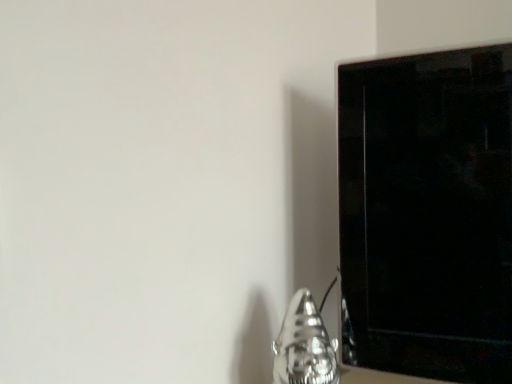
What do you see at coordinates (304, 345) in the screenshot?
I see `shiny metallic gnome at lower right` at bounding box center [304, 345].

Find the location of `shiny metallic gnome at lower right`. shiny metallic gnome at lower right is located at coordinates (304, 345).

Find the location of a particular element. Image resolution: width=512 pixels, height=384 pixels. black glossy tv at right is located at coordinates (426, 214).

Describe the element at coordinates (426, 214) in the screenshot. Image resolution: width=512 pixels, height=384 pixels. I see `black glossy tv at right` at that location.

Identify the location of shiny metallic gnome at lower right. The height and width of the screenshot is (384, 512). (304, 345).

Does black glossy tv at right appear on the right side of shiny metallic gnome at lower right?

Correct, you'll find black glossy tv at right to the right of shiny metallic gnome at lower right.

Which object is more forward, black glossy tv at right or shiny metallic gnome at lower right?

shiny metallic gnome at lower right is in front.

Is point (429, 288) positioned after point (301, 331)?

Yes, point (429, 288) is behind point (301, 331).

From the image's perspective, relative to shiny metallic gnome at lower right, is black glossy tv at right above or below?

black glossy tv at right is situated higher than shiny metallic gnome at lower right in the image.

From a real-world perspective, is black glossy tv at right physically located above or below shiny metallic gnome at lower right?

black glossy tv at right is above shiny metallic gnome at lower right.

Considering the relative sizes of black glossy tv at right and shiny metallic gnome at lower right in the image provided, is black glossy tv at right wider than shiny metallic gnome at lower right?

No, black glossy tv at right is not wider than shiny metallic gnome at lower right.

Considering the sizes of objects black glossy tv at right and shiny metallic gnome at lower right in the image provided, who is shorter, black glossy tv at right or shiny metallic gnome at lower right?

shiny metallic gnome at lower right.

Considering the relative sizes of black glossy tv at right and shiny metallic gnome at lower right in the image provided, is black glossy tv at right smaller than shiny metallic gnome at lower right?

No, black glossy tv at right is not smaller than shiny metallic gnome at lower right.

Is black glossy tv at right situated inside shiny metallic gnome at lower right or outside?

black glossy tv at right is located beyond the bounds of shiny metallic gnome at lower right.

Does black glossy tv at right touch shiny metallic gnome at lower right?

black glossy tv at right and shiny metallic gnome at lower right are not in contact.

Is black glossy tv at right oriented away from shiny metallic gnome at lower right?

No, black glossy tv at right is not facing away from shiny metallic gnome at lower right.

Can you tell me how much black glossy tv at right and shiny metallic gnome at lower right differ in facing direction?

23.2 degrees separate the facing orientations of black glossy tv at right and shiny metallic gnome at lower right.

Measure the distance between black glossy tv at right and shiny metallic gnome at lower right.

black glossy tv at right and shiny metallic gnome at lower right are 8.82 inches apart from each other.

In the image, there is a shiny metallic gnome at lower right. Where is `furniture above it (from the image's perspective)`? The image size is (512, 384). furniture above it (from the image's perspective) is located at coordinates (426, 214).

Which is more to the left, shiny metallic gnome at lower right or black glossy tv at right?

shiny metallic gnome at lower right is more to the left.

Relative to black glossy tv at right, is shiny metallic gnome at lower right in front or behind?

In the image, shiny metallic gnome at lower right appears in front of black glossy tv at right.

Which is nearer, (292,374) or (362,348)?

Point (292,374)

From the picture: From the image's perspective, who appears lower, shiny metallic gnome at lower right or black glossy tv at right?

shiny metallic gnome at lower right is shown below in the image.

From a real-world perspective, who is located lower, shiny metallic gnome at lower right or black glossy tv at right?

shiny metallic gnome at lower right, from a real-world perspective.

Considering the sizes of objects shiny metallic gnome at lower right and black glossy tv at right in the image provided, who is thinner, shiny metallic gnome at lower right or black glossy tv at right?

Thinner between the two is black glossy tv at right.

Does shiny metallic gnome at lower right have a lesser height compared to black glossy tv at right?

Indeed, shiny metallic gnome at lower right has a lesser height compared to black glossy tv at right.

Who is smaller, shiny metallic gnome at lower right or black glossy tv at right?

Smaller between the two is shiny metallic gnome at lower right.

Would you say black glossy tv at right is part of shiny metallic gnome at lower right's contents?

No, black glossy tv at right is located outside of shiny metallic gnome at lower right.

Is shiny metallic gnome at lower right placed right next to black glossy tv at right?

No, shiny metallic gnome at lower right is not with black glossy tv at right.

Is black glossy tv at right at the back of shiny metallic gnome at lower right?

Yes.

You are a GUI agent. You are given a task and a screenshot of the screen. Output one action in this format:
    pyautogui.click(x=<x>, y=<y>)
    Task: Click on the furniture behind the shiny metallic gnome at lower right
    
    Given the screenshot: What is the action you would take?
    pyautogui.click(x=426, y=214)

Image resolution: width=512 pixels, height=384 pixels. What are the coordinates of `furniture lying above the shiny metallic gnome at lower right (from the image's perspective)` in the screenshot? It's located at pos(426,214).

At what (x,y) coordinates should I click in order to perform the action: click on furniture that is on the right side of shiny metallic gnome at lower right. Please return your answer as a coordinate pair (x, y). The width and height of the screenshot is (512, 384). Looking at the image, I should click on (426, 214).